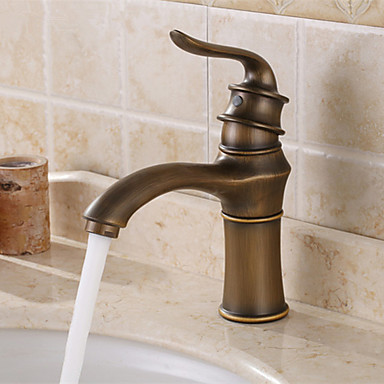
Locate an element on the screen. The image size is (384, 384). faucet is located at coordinates (164, 176).